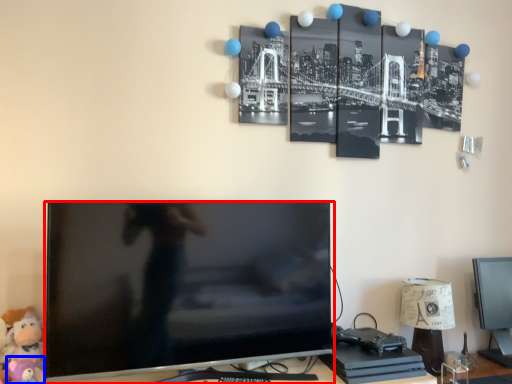
Question: Which object is closer to the camera taking this photo, television (highlighted by a red box) or toy (highlighted by a blue box)?

Choices:
 (A) television
 (B) toy

Answer: (A)